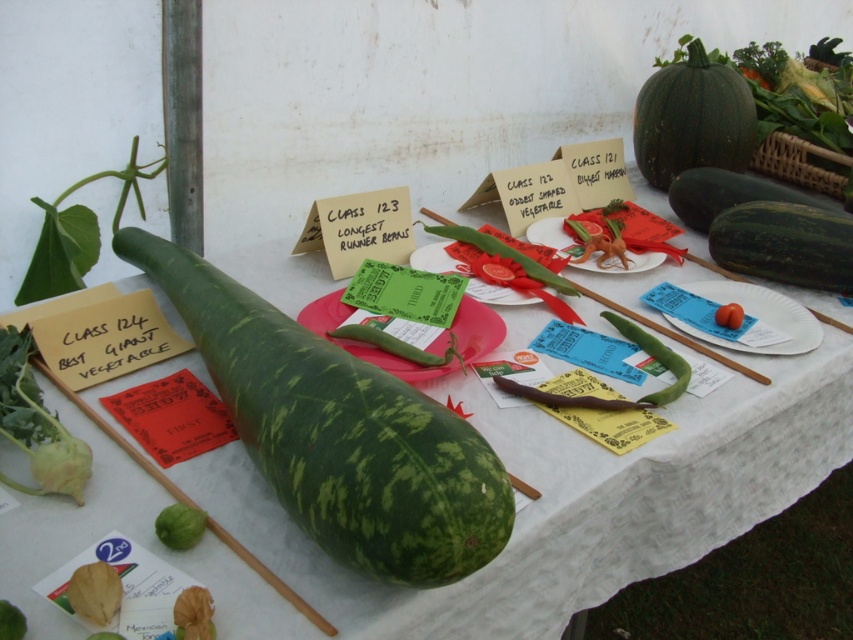
Question: Which object is positioned farthest from the green matte platter at center?

Choices:
 (A) green spotted squash at center
 (B) green spotted squash at left
 (C) green matte squash at center

Answer: (B)

Question: Can you confirm if green spotted squash at left is bigger than green matte cucumber at right?

Choices:
 (A) no
 (B) yes

Answer: (A)

Question: Which object appears closest to the camera in this image?

Choices:
 (A) matte green plate at center
 (B) green matte squash at center
 (C) green matte platter at center

Answer: (B)

Question: Does green spotted gourd at center appear under green spotted squash at center?

Choices:
 (A) yes
 (B) no

Answer: (B)

Question: Can you confirm if green matte cucumber at center is positioned to the left of green matte squash at center?

Choices:
 (A) no
 (B) yes

Answer: (A)

Question: Based on their relative distances, which object is nearer to the green matte platter at center?

Choices:
 (A) green spotted squash at center
 (B) matte green plate at center
 (C) green matte squash at upper right

Answer: (A)